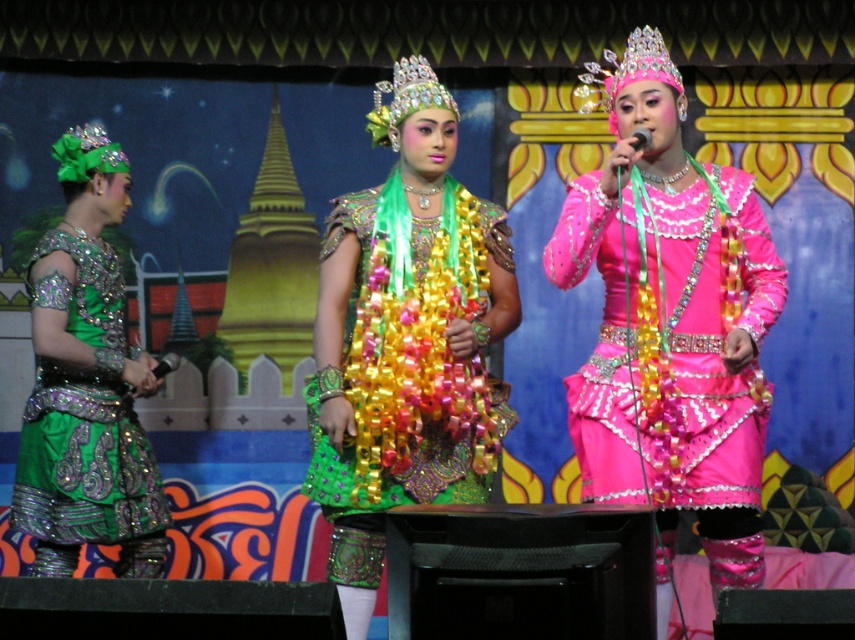
Question: Which object is the farthest from the green sequined dress at left?

Choices:
 (A) shiny green fabric dress at center
 (B) pink sequined dress at center

Answer: (B)

Question: Can you confirm if pink sequined dress at center is wider than shiny green fabric dress at center?

Choices:
 (A) yes
 (B) no

Answer: (A)

Question: Which is farther from the green sequined dress at left?

Choices:
 (A) pink sequined dress at center
 (B) shiny green fabric dress at center

Answer: (A)

Question: From the image, what is the correct spatial relationship of pink sequined dress at center in relation to shiny green fabric dress at center?

Choices:
 (A) above
 (B) below

Answer: (A)

Question: Which point is closer to the camera taking this photo?

Choices:
 (A) (629, 84)
 (B) (124, 356)

Answer: (A)

Question: Does pink sequined dress at center have a larger size compared to green sequined dress at left?

Choices:
 (A) no
 (B) yes

Answer: (B)